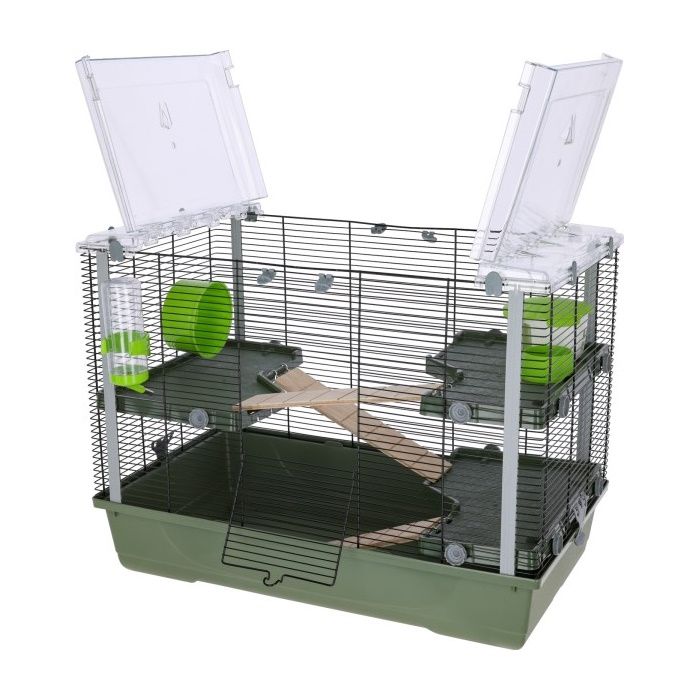
The image size is (700, 700). I want to click on grey pannel, so click(470, 505).